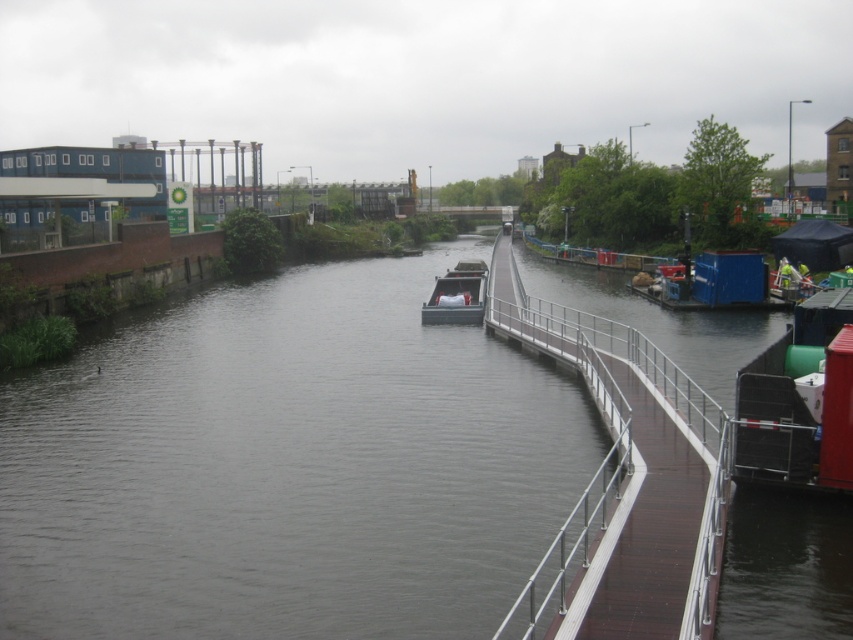
Question: Does dark gray water at center have a lesser width compared to dark gray metallic boat at center?

Choices:
 (A) yes
 (B) no

Answer: (B)

Question: Is dark gray water at center bigger than dark gray metallic boat at center?

Choices:
 (A) yes
 (B) no

Answer: (A)

Question: Which object is farther from the camera taking this photo?

Choices:
 (A) dark gray metallic boat at center
 (B) dark gray water at center

Answer: (A)

Question: Can you confirm if dark gray water at center is thinner than dark gray metallic boat at center?

Choices:
 (A) yes
 (B) no

Answer: (B)